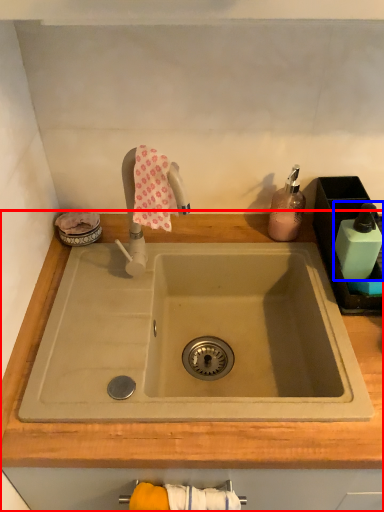
Question: Which object appears farthest to the camera in this image, countertop (highlighted by a red box) or toiletry (highlighted by a blue box)?

Choices:
 (A) countertop
 (B) toiletry

Answer: (B)